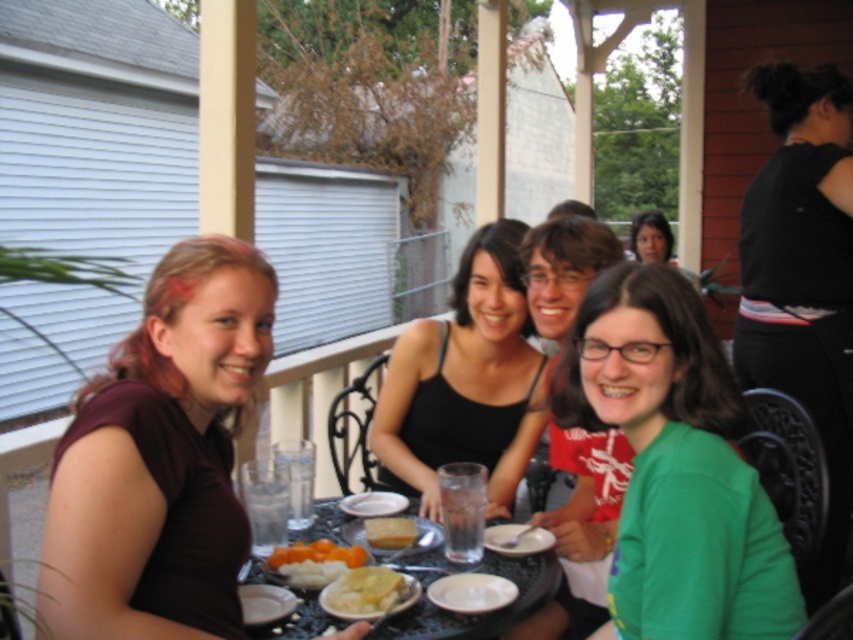
Is point (527, 561) positioned behind point (322, 602)?

Yes, it is.

Between point (492, 554) and point (363, 604), which one is positioned in front?

Point (363, 604) is in front.

At what (x,y) coordinates should I click in order to perform the action: click on translucent glass table at center. Please return your answer as a coordinate pair (x, y). Looking at the image, I should click on (480, 614).

Based on the photo, can you confirm if matte black shirt at left is positioned to the right of matte black tank top at center?

In fact, matte black shirt at left is to the left of matte black tank top at center.

Locate an element on the screen. Image resolution: width=853 pixels, height=640 pixels. matte black shirt at left is located at coordinates (161, 458).

Who is higher up, yellowish matte chips at center or white matte plate at lower center?

yellowish matte chips at center

Is yellowish matte chips at center above white matte plate at lower center?

Indeed, yellowish matte chips at center is positioned over white matte plate at lower center.

Where is `yellowish matte chips at center`? Image resolution: width=853 pixels, height=640 pixels. yellowish matte chips at center is located at coordinates (364, 589).

You are a GUI agent. You are given a task and a screenshot of the screen. Output one action in this format:
    pyautogui.click(x=<x>, y=<y>)
    Task: Click on the yellowish matte chips at center
    This screenshot has height=640, width=853.
    Given the screenshot: What is the action you would take?
    pyautogui.click(x=364, y=589)